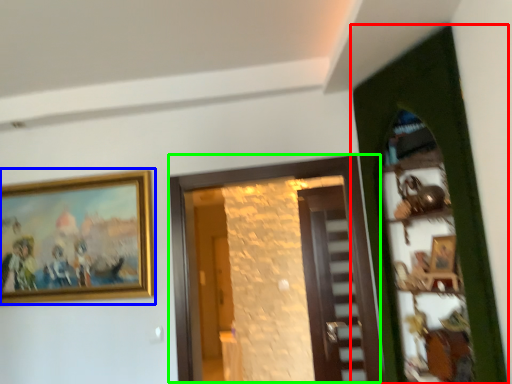
Question: Which object is positioned farthest from door (highlighted by a red box)? Select from picture frame (highlighted by a blue box) and door (highlighted by a green box).

Choices:
 (A) picture frame
 (B) door

Answer: (A)